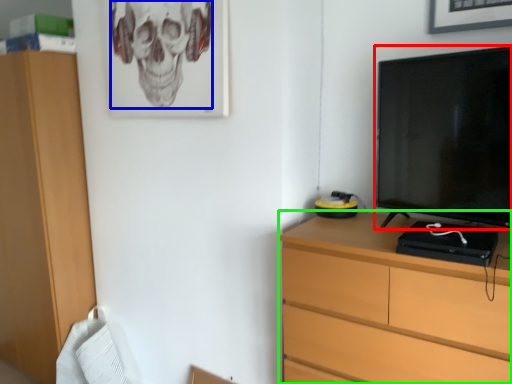
Question: Which object is positioned closest to television (highlighted by a red box)? Select from skull (highlighted by a blue box) and chest of drawers (highlighted by a green box).

Choices:
 (A) skull
 (B) chest of drawers

Answer: (B)